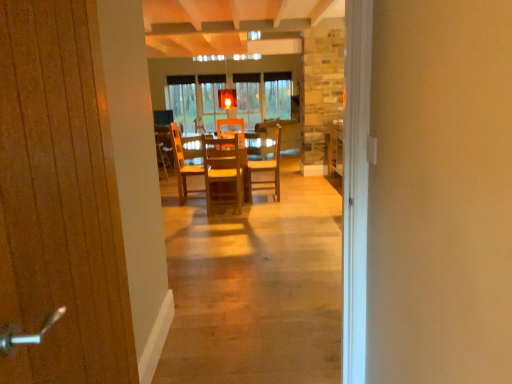
Question: From a real-world perspective, relative to wooden chair at center, is wooden table at center vertically above or below?

Choices:
 (A) below
 (B) above

Answer: (A)

Question: In terms of size, does wooden table at center appear bigger or smaller than wooden chair at center?

Choices:
 (A) big
 (B) small

Answer: (A)

Question: Estimate the real-world distances between objects in this image. Which object is closer to the wooden chair at center?

Choices:
 (A) wooden chair at center, which appears as the first chair when viewed from the back
 (B) wooden chair at center, which appears as the first chair when viewed from the front
 (C) wooden door at left
 (D) wooden table at center

Answer: (D)

Question: Which object is positioned farthest from the wooden table at center?

Choices:
 (A) wooden chair at center, the second chair in the back-to-front sequence
 (B) wooden chair at center, the 2th chair positioned from the left
 (C) wooden chair at center
 (D) wooden door at left

Answer: (D)